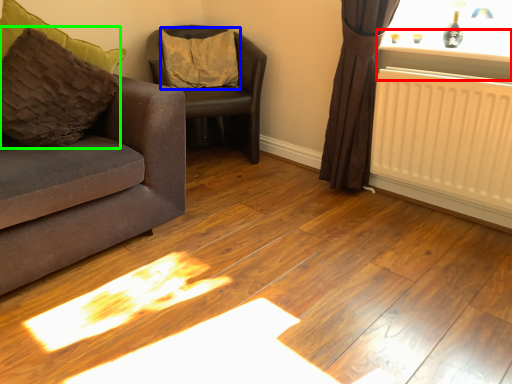
Question: Considering the real-world distances, which object is closest to window sill (highlighted by a red box)? pillow (highlighted by a blue box) or pillow (highlighted by a green box).

Choices:
 (A) pillow
 (B) pillow

Answer: (A)